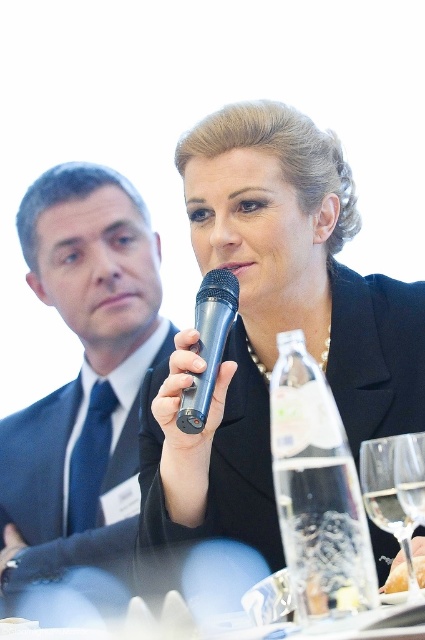
Is point (62, 525) behind point (362, 467)?

Yes, it is behind point (362, 467).

Can you confirm if dark blue suit at left is positioned above transparent glass wine glass at center?

Correct, dark blue suit at left is located above transparent glass wine glass at center.

Locate an element on the screen. This screenshot has height=640, width=425. dark blue suit at left is located at coordinates (82, 378).

At what (x,y) coordinates should I click in order to perform the action: click on black matte microphone at center. Please return your answer as a coordinate pair (x, y). The image size is (425, 640). Looking at the image, I should click on [x=272, y=324].

Is point (218, 403) positioned behind point (6, 429)?

That is False.

Locate an element on the screen. This screenshot has width=425, height=640. black matte microphone at center is located at coordinates (272, 324).

Is point (99, 369) farther from camera compared to point (209, 273)?

Yes, it is behind point (209, 273).

Is dark blue suit at left further to camera compared to metallic blue microphone at center?

Yes, it is.

Locate an element on the screen. The width and height of the screenshot is (425, 640). dark blue suit at left is located at coordinates (82, 378).